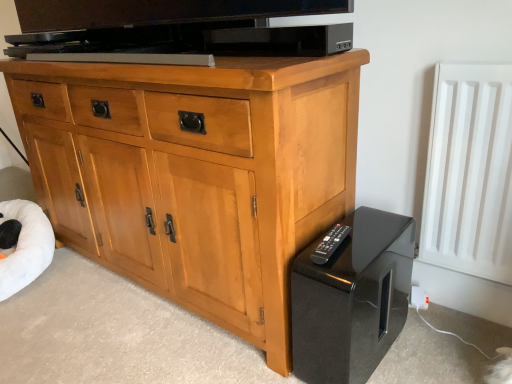
Where is `vacant space underneath black glossy speaker at lower right (from a real-world perspective)`? The height and width of the screenshot is (384, 512). vacant space underneath black glossy speaker at lower right (from a real-world perspective) is located at coordinates (358, 349).